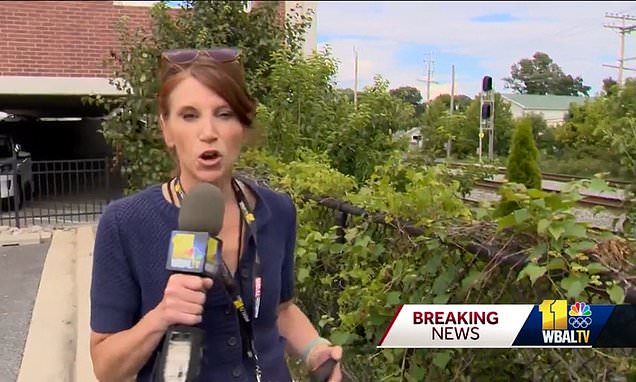
Find the location of `plante`. plante is located at coordinates (396, 244).